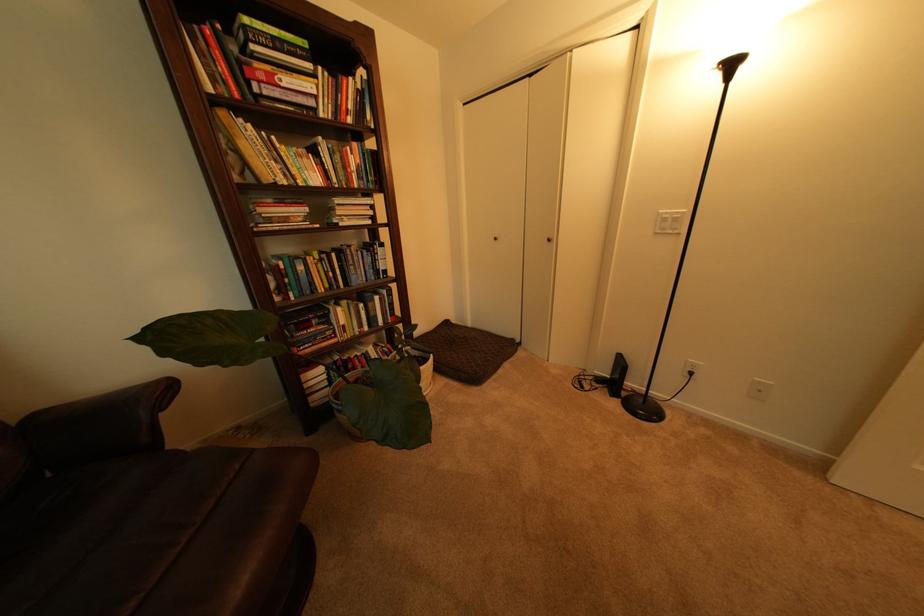
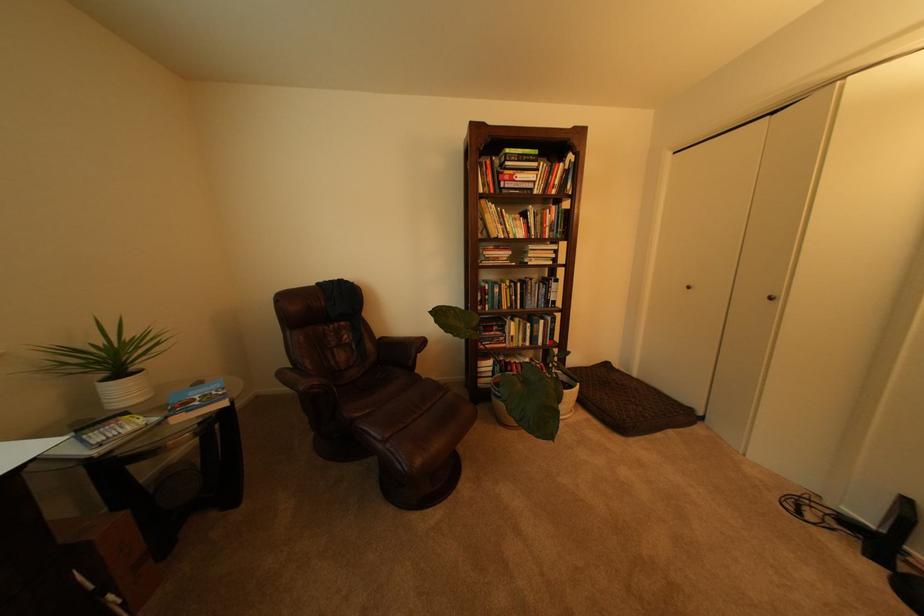
Locate, in the second image, the point that corresponds to pixel 367 260 in the first image.

(543, 290)